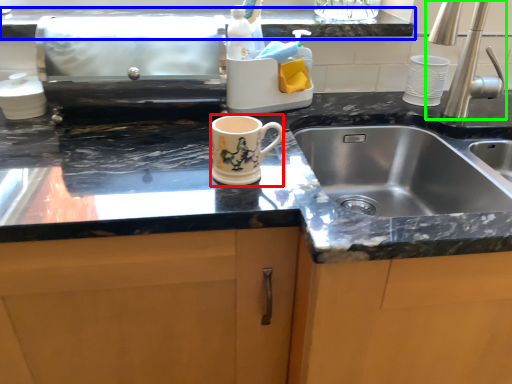
Question: Based on their relative distances, which object is nearer to mug (highlighted by a red box)? Choose from countertop (highlighted by a blue box) and tap (highlighted by a green box).

Choices:
 (A) countertop
 (B) tap

Answer: (A)